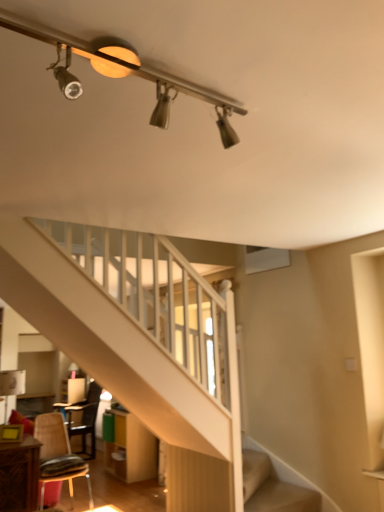
Question: Does metallic track lighting at upper center turn towards wooden chair at lower left, marked as the second chair in a front-to-back arrangement?

Choices:
 (A) yes
 (B) no

Answer: (B)

Question: Is metallic track lighting at upper center bigger than wooden chair at lower left, marked as the second chair in a front-to-back arrangement?

Choices:
 (A) yes
 (B) no

Answer: (B)

Question: Does metallic track lighting at upper center come behind wooden chair at lower left, marked as the second chair in a front-to-back arrangement?

Choices:
 (A) yes
 (B) no

Answer: (B)

Question: From the image's perspective, does metallic track lighting at upper center appear lower than wooden chair at lower left, marked as the second chair in a front-to-back arrangement?

Choices:
 (A) yes
 (B) no

Answer: (B)

Question: From a real-world perspective, is metallic track lighting at upper center located higher than wooden chair at lower left, marked as the second chair in a front-to-back arrangement?

Choices:
 (A) yes
 (B) no

Answer: (A)

Question: Is metallic track lighting at upper center taller than wooden chair at lower left, marked as the second chair in a front-to-back arrangement?

Choices:
 (A) yes
 (B) no

Answer: (B)

Question: Is wooden chair at lower left, the 1th chair when ordered from back to front, bigger than metallic brown chair at lower left, which appears as the 1th chair when viewed from the front?

Choices:
 (A) no
 (B) yes

Answer: (B)

Question: Is wooden chair at lower left, the 1th chair when ordered from back to front, taller than metallic brown chair at lower left, which appears as the 1th chair when viewed from the front?

Choices:
 (A) no
 (B) yes

Answer: (B)

Question: Considering the relative sizes of wooden chair at lower left, marked as the second chair in a front-to-back arrangement, and metallic brown chair at lower left, which appears as the 1th chair when viewed from the front, in the image provided, is wooden chair at lower left, marked as the second chair in a front-to-back arrangement, thinner than metallic brown chair at lower left, which appears as the 1th chair when viewed from the front,?

Choices:
 (A) no
 (B) yes

Answer: (A)

Question: Is wooden chair at lower left, the 1th chair when ordered from back to front, behind metallic brown chair at lower left, which appears as the 1th chair when viewed from the front?

Choices:
 (A) yes
 (B) no

Answer: (A)

Question: From a real-world perspective, is wooden chair at lower left, the 1th chair when ordered from back to front, over metallic brown chair at lower left, which is counted as the 2th chair, starting from the back?

Choices:
 (A) no
 (B) yes

Answer: (B)

Question: From the image's perspective, is wooden chair at lower left, marked as the second chair in a front-to-back arrangement, located above metallic brown chair at lower left, which is counted as the 2th chair, starting from the back?

Choices:
 (A) yes
 (B) no

Answer: (B)

Question: Is metallic brown chair at lower left, which is counted as the 2th chair, starting from the back, directly adjacent to wooden chair at lower left, the 1th chair when ordered from back to front?

Choices:
 (A) yes
 (B) no

Answer: (B)